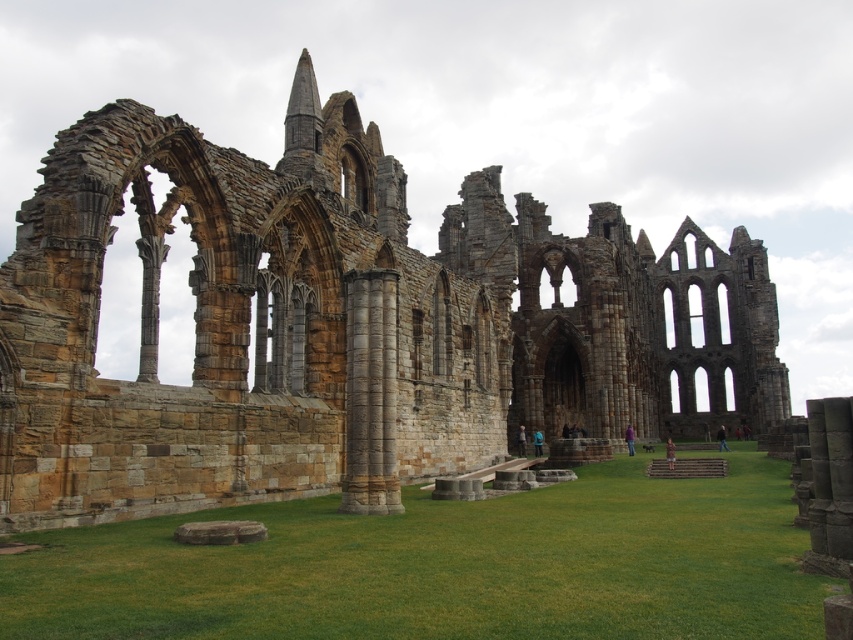
You are a visitor standing at the entrance of the ruins. You notice the brown stone ruins at center and the green grass at center. Which object is significantly taller?

The brown stone ruins at center are much taller than the green grass at center.

You are a tour guide explaining the historical site to visitors. You point out the brown stone ruins at center and the green grass at center. Which of these two features is wider?

The brown stone ruins at center might be wider than green grass at center according to the description provided.